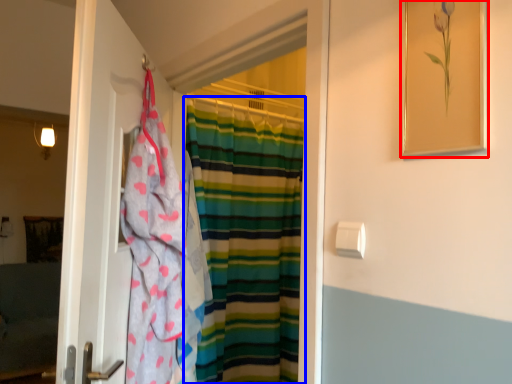
Question: Which object appears farthest to the camera in this image, picture frame (highlighted by a red box) or curtain (highlighted by a blue box)?

Choices:
 (A) picture frame
 (B) curtain

Answer: (B)